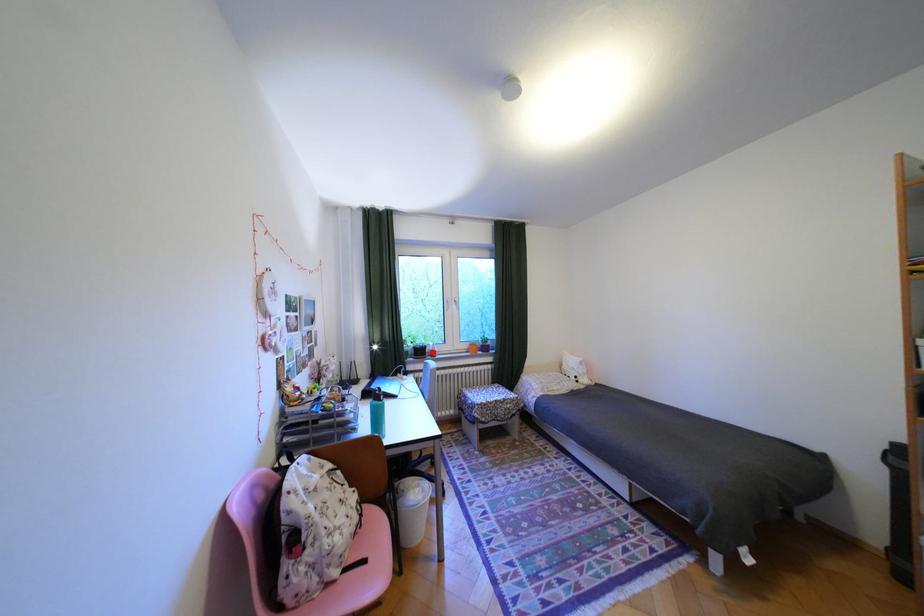
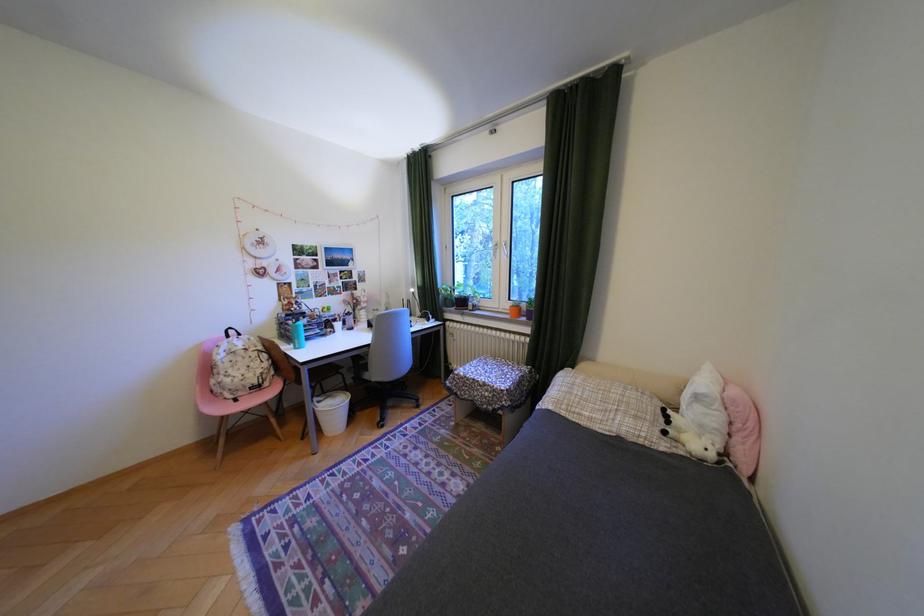
Question: A red point is marked in image1. In image2, is the corresponding 3D point closer to the camera or farther? Reply with the corresponding letter.

Choices:
 (A) The corresponding 3D point is closer.
 (B) The corresponding 3D point is farther.

Answer: (A)